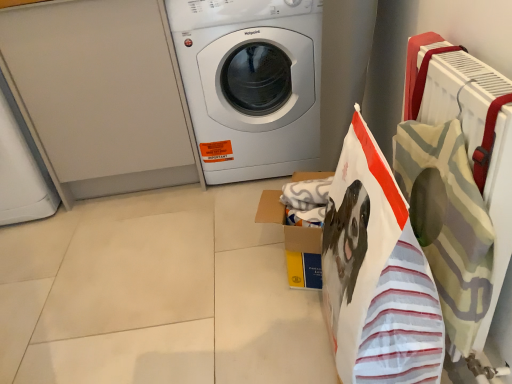
Find the location of a particular element. This screenshot has width=512, height=384. unoccupied area in front of yellow cardboard box at center is located at coordinates (280, 322).